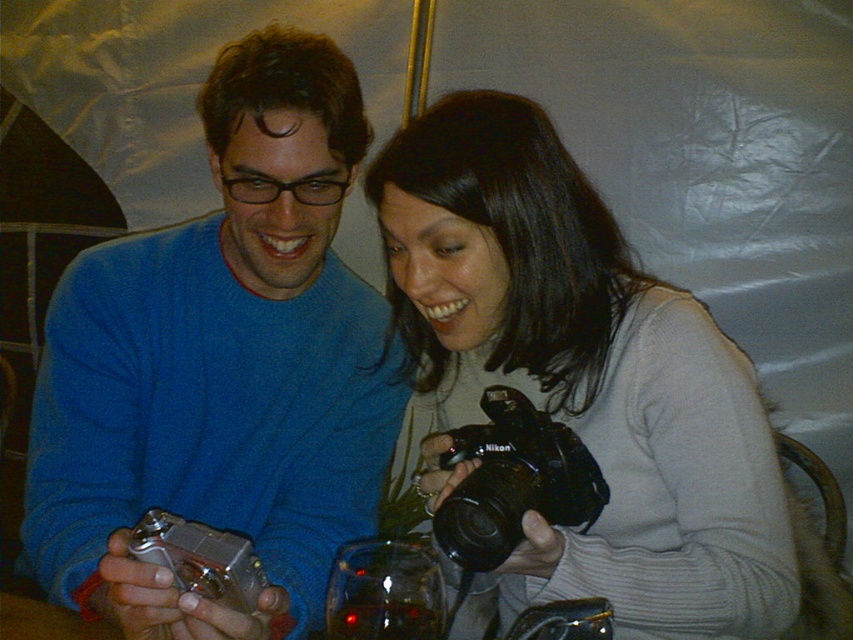
Question: Which point appears farthest from the camera in this image?

Choices:
 (A) (421, 184)
 (B) (175, 308)
 (C) (178, 531)
 (D) (473, 561)

Answer: (B)

Question: Which point is farther to the camera?

Choices:
 (A) (666, 369)
 (B) (474, 554)

Answer: (A)

Question: Does matte blue sweater at center have a smaller size compared to silver metallic digital camera at lower left?

Choices:
 (A) yes
 (B) no

Answer: (B)

Question: Is matte black camera at center wider than black plastic camera at center?

Choices:
 (A) no
 (B) yes

Answer: (B)

Question: Is the position of matte blue sweater at center less distant than that of matte black camera at center?

Choices:
 (A) yes
 (B) no

Answer: (A)

Question: Based on their relative distances, which object is nearer to the matte black camera at center?

Choices:
 (A) black plastic camera at center
 (B) matte blue sweater at center
 (C) silver metallic digital camera at lower left

Answer: (A)